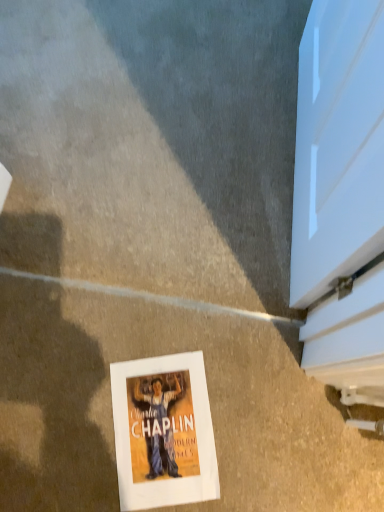
Find the location of `vacant point above white paper at lower center (from a real-world perspective)`. vacant point above white paper at lower center (from a real-world perspective) is located at coordinates (154, 425).